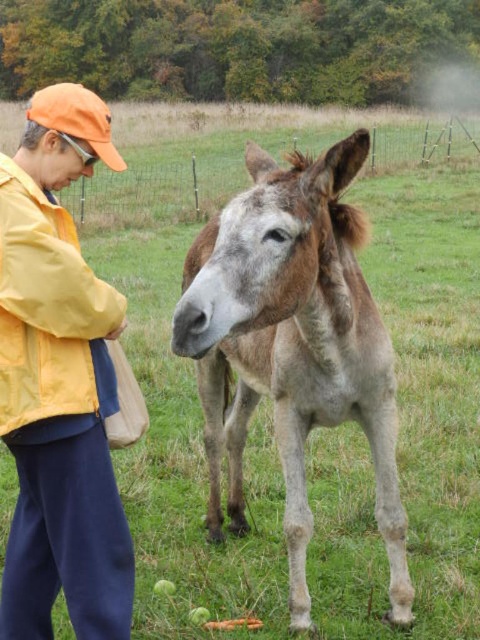
You are a photographer trying to capture a clear photo of the fuzzy brown donkey at center and the orange fabric cap at upper left. Since you want both subjects to be in focus, you need to adjust your camera settings. Considering their sizes, which subject should you focus on first to ensure proper depth of field?

The fuzzy brown donkey at center is larger than the orange fabric cap at upper left. To ensure both are in focus, you should focus on the larger subject, the fuzzy brown donkey at center, as depth of field is more critical for larger objects.

From the picture: You are a photographer trying to capture a clear shot of the fuzzy brown donkey at center and the orange fabric cap at upper left. From your current position, can you see both objects without any obstruction?

Yes, the fuzzy brown donkey at center is in front of orange fabric cap at upper left, so the photographer can see both objects clearly as the donkey does not block the cap from view.